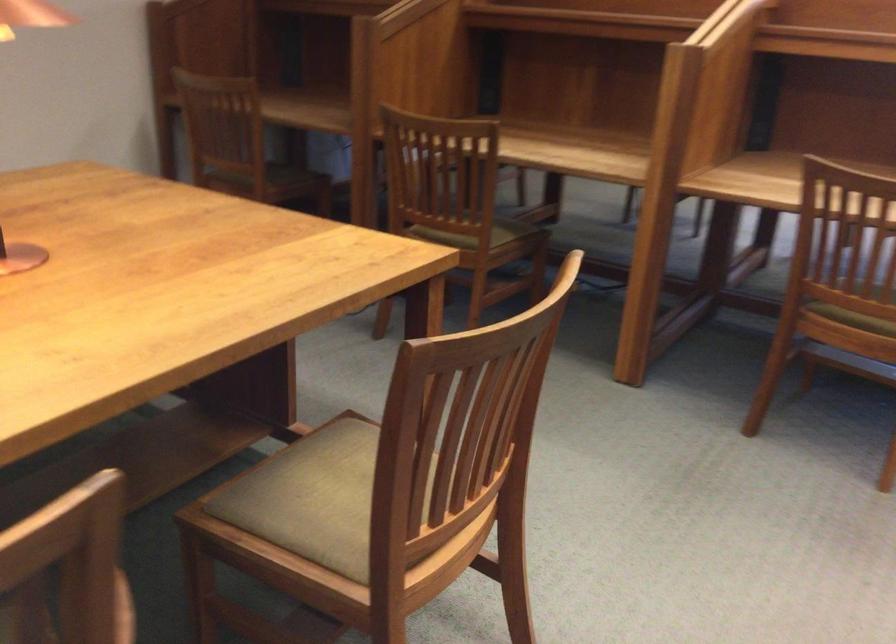
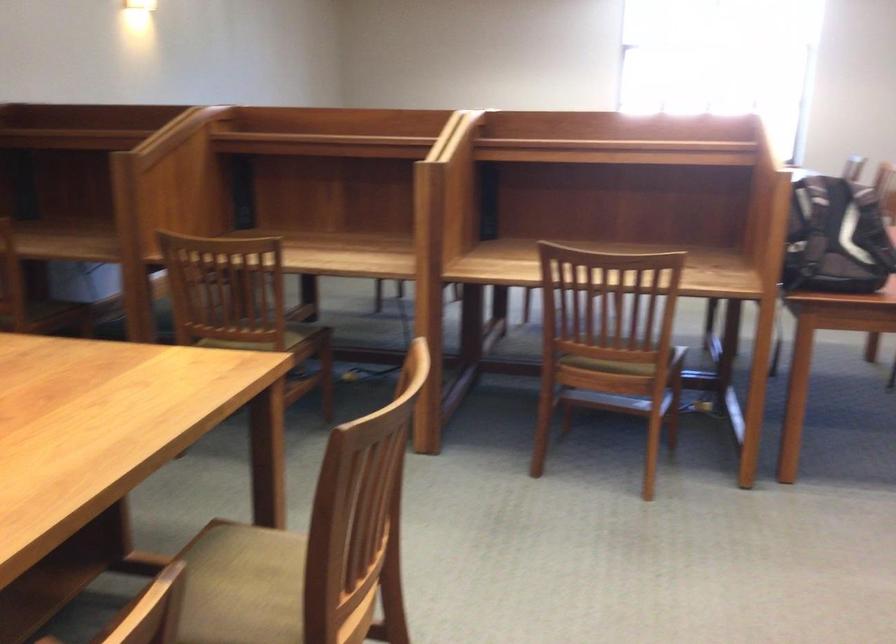
Question: The first image is from the beginning of the video and the second image is from the end. How did the camera likely rotate when shooting the video?

Choices:
 (A) Left
 (B) Right
 (C) Up
 (D) Down

Answer: (B)